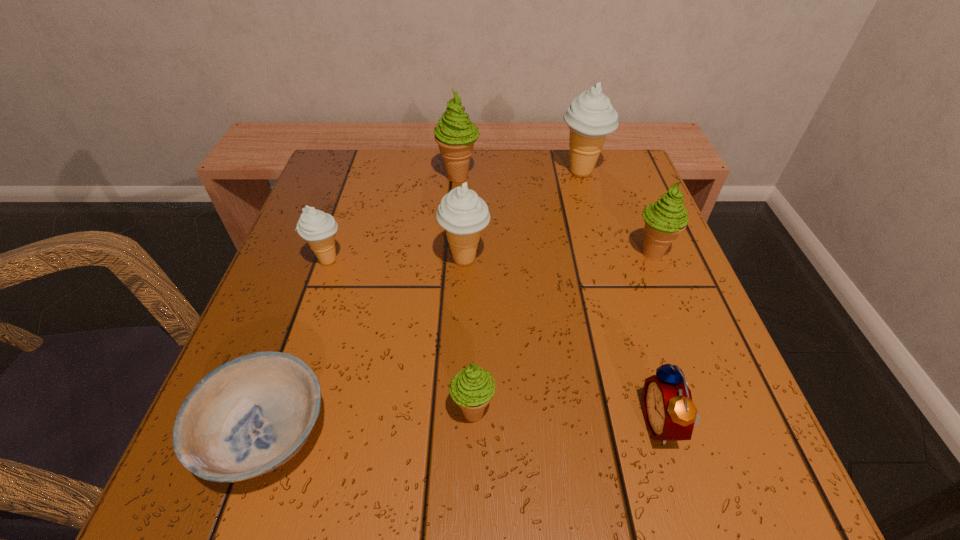
What are the coordinates of `alarm clock` in the screenshot? It's located at (670, 415).

Find the location of a particular element. The image size is (960, 540). bowl is located at coordinates (247, 417).

Locate an element on the screen. The width and height of the screenshot is (960, 540). the shortest object is located at coordinates (247, 417).

Where is `vacant region located 0.120m on the right of the biggest green icecream`? vacant region located 0.120m on the right of the biggest green icecream is located at coordinates (531, 177).

Identify the location of blank space located on the left of the rightmost beige icecream. This screenshot has width=960, height=540. (410, 172).

Find the location of a particular element. vacant point located on the back of the second smallest green icecream is located at coordinates (622, 178).

Locate an element on the screen. This screenshot has height=540, width=960. vacant space positioned 0.180m on the back of the second beige icecream from right to left is located at coordinates (468, 190).

Where is `free space located 0.070m on the front of the leftmost beige icecream`? free space located 0.070m on the front of the leftmost beige icecream is located at coordinates point(313,302).

You are a GUI agent. You are given a task and a screenshot of the screen. Output one action in this format:
    pyautogui.click(x=<x>, y=<y>)
    Task: Click on the vacant space situated 0.310m on the right of the nearest icecream
    Image resolution: width=960 pixels, height=540 pixels.
    Given the screenshot: What is the action you would take?
    pyautogui.click(x=712, y=411)

Image resolution: width=960 pixels, height=540 pixels. Identify the location of free spot located on the front-facing side of the alarm clock. (572, 423).